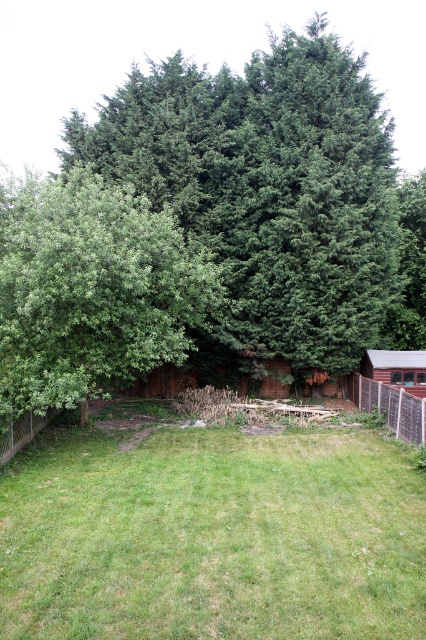
Question: Among these points, which one is farthest from the camera?

Choices:
 (A) (362, 404)
 (B) (20, 422)

Answer: (A)

Question: Does green leafy tree at left have a lesser width compared to wooden fence at lower left?

Choices:
 (A) no
 (B) yes

Answer: (A)

Question: Which point is closer to the camera?

Choices:
 (A) green leafy tree at left
 (B) green leafy tree at upper center

Answer: (A)

Question: Which object appears closest to the camera in this image?

Choices:
 (A) green leafy tree at left
 (B) green leafy tree at upper center
 (C) wooden fence at lower left
 (D) green grass at center

Answer: (D)

Question: Where is green leafy tree at left located in relation to wooden fence at lower right in the image?

Choices:
 (A) left
 (B) right

Answer: (A)

Question: Can you confirm if green leafy tree at upper center is bigger than wooden fence at lower right?

Choices:
 (A) yes
 (B) no

Answer: (A)